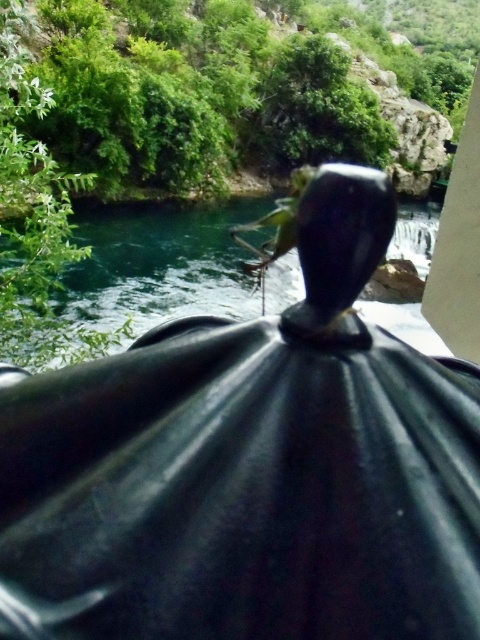
Question: Which point is closer to the camera?

Choices:
 (A) (127, 330)
 (B) (78, 593)

Answer: (B)

Question: Is black glossy umbrella at center positioned at the back of green glossy water at center?

Choices:
 (A) yes
 (B) no

Answer: (B)

Question: Which object is closer to the camera taking this photo?

Choices:
 (A) black glossy umbrella at center
 (B) green glossy water at center

Answer: (A)

Question: Does black glossy umbrella at center appear over green glossy water at center?

Choices:
 (A) no
 (B) yes

Answer: (A)

Question: Which point is farther to the camera?

Choices:
 (A) (123, 260)
 (B) (395, 593)

Answer: (A)

Question: Is black glossy umbrella at center further to the viewer compared to green glossy water at center?

Choices:
 (A) yes
 (B) no

Answer: (B)